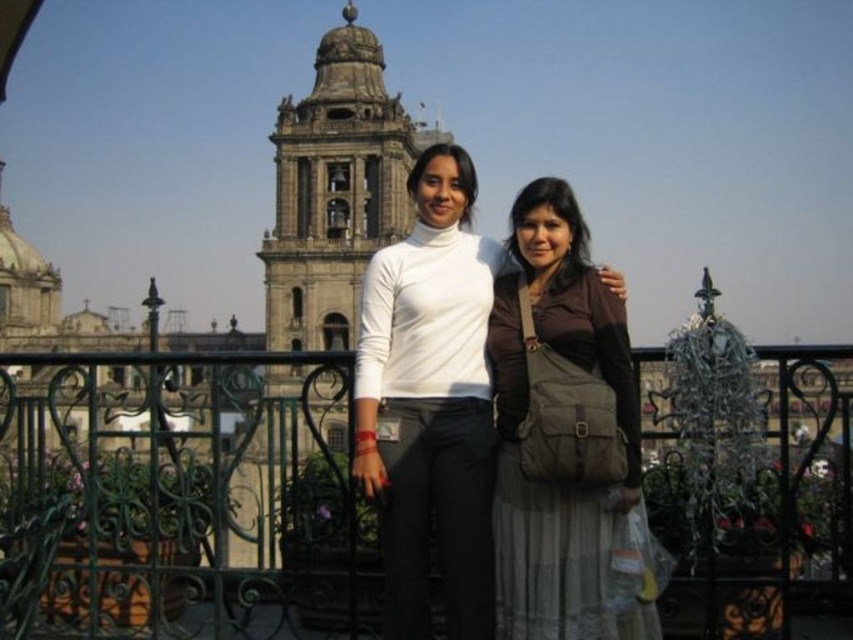
Question: Can you confirm if green wrought iron railing at center is bigger than matte brown bag at center?

Choices:
 (A) no
 (B) yes

Answer: (B)

Question: Does green wrought iron railing at center come in front of matte brown bag at center?

Choices:
 (A) yes
 (B) no

Answer: (A)

Question: Which object is positioned farthest from the matte brown bag at center?

Choices:
 (A) green wrought iron railing at center
 (B) matte brown dress at center

Answer: (A)

Question: Which point is closer to the camera taking this photo?

Choices:
 (A) (56, 468)
 (B) (643, 541)

Answer: (B)

Question: Which point is closer to the camera taking this photo?

Choices:
 (A) (462, 538)
 (B) (556, 384)
 (C) (149, 536)

Answer: (A)

Question: Observing the image, what is the correct spatial positioning of matte brown bag at center in reference to matte brown dress at center?

Choices:
 (A) above
 (B) below

Answer: (B)